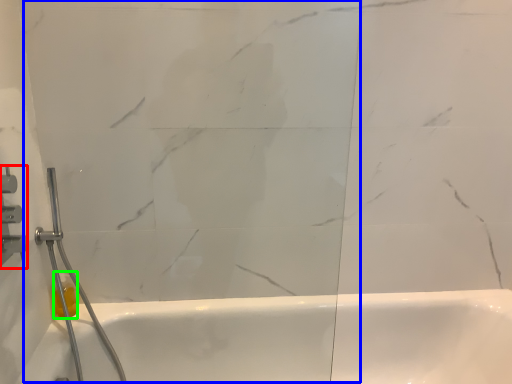
Question: Considering the real-world distances, which object is closest to shower (highlighted by a red box)? glass door (highlighted by a blue box) or toiletry (highlighted by a green box).

Choices:
 (A) glass door
 (B) toiletry

Answer: (B)